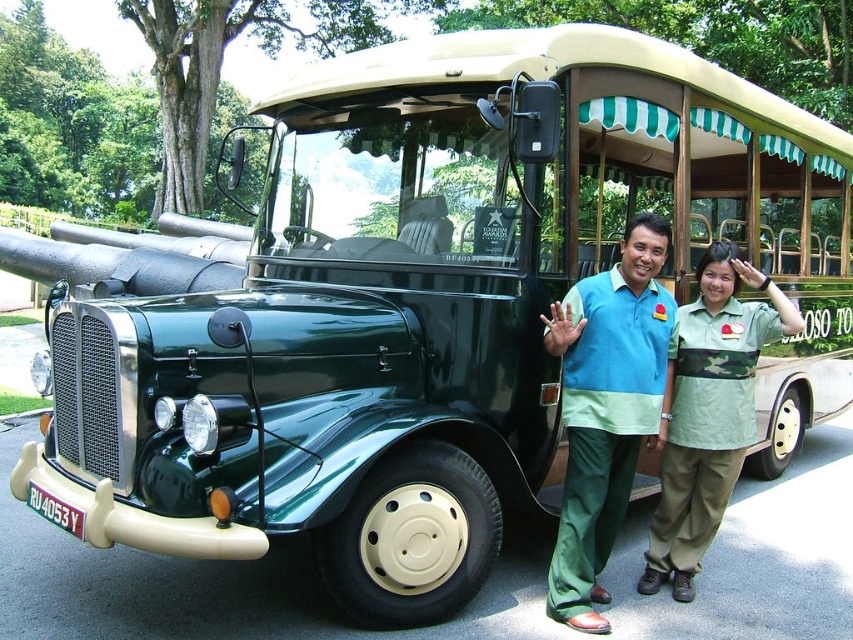
Question: Is blue-green fabric shirt at center below camouflage fabric shirt at center?

Choices:
 (A) yes
 (B) no

Answer: (B)

Question: Which object appears closest to the camera in this image?

Choices:
 (A) blue-green fabric shirt at center
 (B) camouflage fabric shirt at center

Answer: (A)

Question: Is blue-green fabric shirt at center above camouflage fabric shirt at center?

Choices:
 (A) no
 (B) yes

Answer: (B)

Question: Which point is farther from the camera taking this photo?

Choices:
 (A) (583, 369)
 (B) (672, 401)

Answer: (B)

Question: In this image, where is blue-green fabric shirt at center located relative to camouflage fabric shirt at center?

Choices:
 (A) left
 (B) right

Answer: (A)